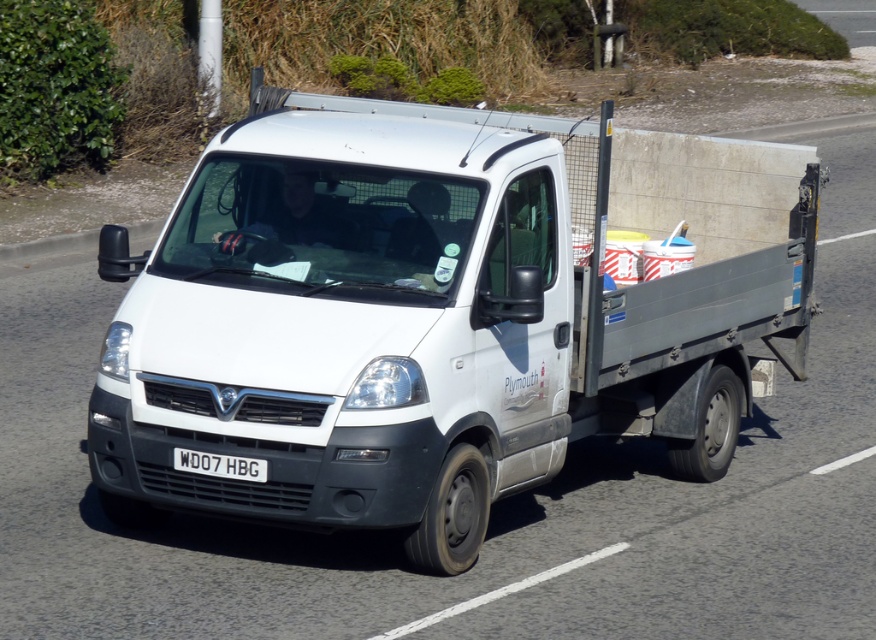
Can you confirm if white matte van at center is positioned to the left of white plastic license plate at center?

In fact, white matte van at center is to the right of white plastic license plate at center.

Based on the photo, which is more to the right, white matte van at center or white plastic license plate at center?

white matte van at center is more to the right.

Image resolution: width=876 pixels, height=640 pixels. What are the coordinates of `white matte van at center` in the screenshot? It's located at (438, 314).